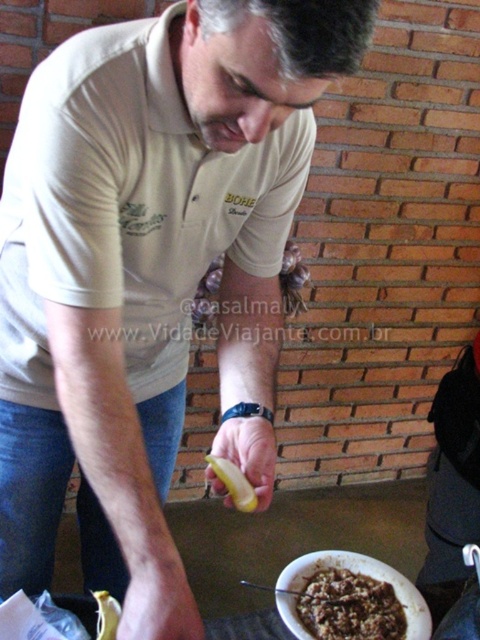
Question: Which of these objects is positioned farthest from the brown matte food at lower center?

Choices:
 (A) yellow matte banana at lower center
 (B) yellow matte banana at center

Answer: (A)

Question: Which of the following is the closest to the observer?

Choices:
 (A) (109, 630)
 (B) (331, 630)
 (C) (252, 506)

Answer: (A)

Question: Which point is closer to the camera taking this photo?

Choices:
 (A) (364, 616)
 (B) (105, 627)
 (C) (210, 467)

Answer: (B)

Question: Does brown matte food at lower center appear under yellow matte banana at lower center?

Choices:
 (A) yes
 (B) no

Answer: (A)

Question: Does yellow matte banana at center appear over yellow matte banana at lower center?

Choices:
 (A) yes
 (B) no

Answer: (A)

Question: Is brown matte food at lower center smaller than yellow matte banana at center?

Choices:
 (A) no
 (B) yes

Answer: (A)